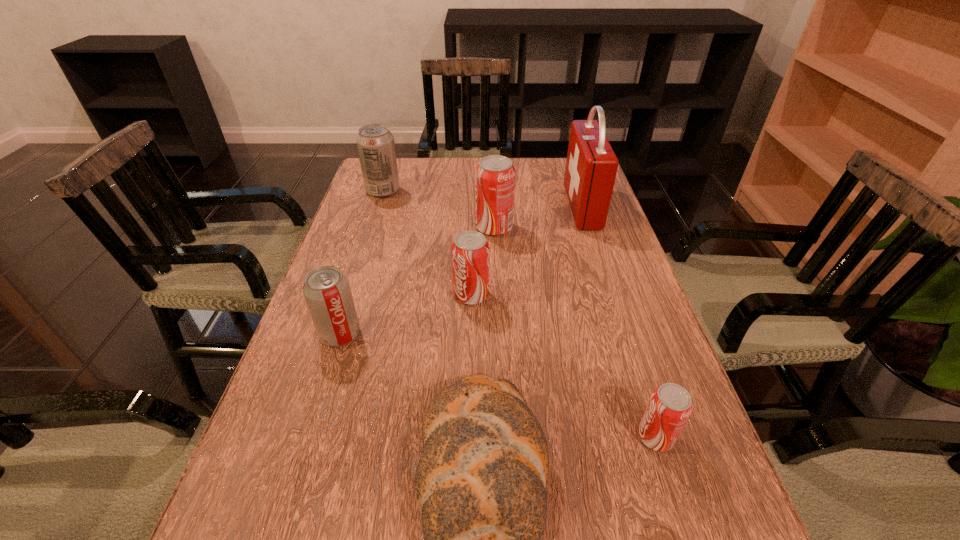
Locate an element on the screen. This screenshot has height=540, width=960. vacant space at the far edge of the desktop is located at coordinates (455, 181).

In the image, there is a desktop. What are the coordinates of `vacant space at the left edge` in the screenshot? It's located at (348, 447).

Find the location of `blank space at the right edge of the desktop`. blank space at the right edge of the desktop is located at coordinates (672, 370).

Identify the location of free region at the far right corner. (550, 192).

Identify the location of vacant area that lies between the tallest object and the second smallest red soda can. [x=527, y=251].

Identify the location of vacant space that is in between the fourth farthest soda can and the farthest soda can. (362, 262).

Identify the location of free space between the farthest soda can and the second nearest red soda can. The image size is (960, 540). (427, 243).

The height and width of the screenshot is (540, 960). I want to click on free space between the fourth nearest soda can and the rightmost soda can, so click(575, 333).

Where is `free space between the tallest object and the rightmost red soda can`? free space between the tallest object and the rightmost red soda can is located at coordinates (619, 322).

Identify which object is the sixth closest to the farthest soda can. Please provide its 2D coordinates. Your answer should be formatted as a tuple, i.e. [(x, y)], where the tuple contains the x and y coordinates of a point satisfying the conditions above.

[(670, 405)]